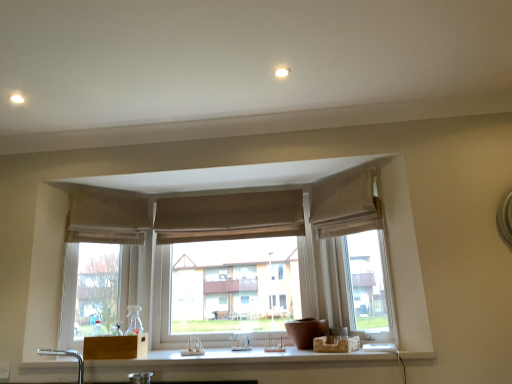
Identify the location of beige fabric curtain at upper right, which ranks as the 1th curtain in right-to-left order. The image size is (512, 384). (346, 206).

Identify the location of beige fabric curtain at upper center, the 3th curtain in the right-to-left sequence. Image resolution: width=512 pixels, height=384 pixels. (106, 219).

Looking at this image, considering the sizes of objects brown fabric curtain at center, marked as the 2th curtain in a right-to-left arrangement, and beige fabric curtain at upper right, which ranks as the 1th curtain in right-to-left order, in the image provided, who is taller, brown fabric curtain at center, marked as the 2th curtain in a right-to-left arrangement, or beige fabric curtain at upper right, which ranks as the 1th curtain in right-to-left order,?

beige fabric curtain at upper right, which ranks as the 1th curtain in right-to-left order.

From a real-world perspective, who is located higher, brown fabric curtain at center, marked as the 2th curtain in a right-to-left arrangement, or beige fabric curtain at upper right, which ranks as the 1th curtain in right-to-left order?

In real-world perspective, brown fabric curtain at center, marked as the 2th curtain in a right-to-left arrangement, is above.

Which is farther, (264,193) or (358,183)?

The point (264,193) is farther.

Is brown fabric curtain at center, placed as the 2th curtain when sorted from left to right, touching beige fabric curtain at upper right, which ranks as the 1th curtain in right-to-left order?

No, brown fabric curtain at center, placed as the 2th curtain when sorted from left to right, is not touching beige fabric curtain at upper right, which ranks as the 1th curtain in right-to-left order.

Considering the sizes of objects beige fabric curtain at upper right, the 3th curtain when ordered from left to right, and beige fabric curtain at upper center, the first curtain in the left-to-right sequence, in the image provided, who is shorter, beige fabric curtain at upper right, the 3th curtain when ordered from left to right, or beige fabric curtain at upper center, the first curtain in the left-to-right sequence,?

beige fabric curtain at upper center, the first curtain in the left-to-right sequence, is shorter.

Can you confirm if beige fabric curtain at upper right, which ranks as the 1th curtain in right-to-left order, is positioned to the left of beige fabric curtain at upper center, the first curtain in the left-to-right sequence?

Incorrect, beige fabric curtain at upper right, which ranks as the 1th curtain in right-to-left order, is not on the left side of beige fabric curtain at upper center, the first curtain in the left-to-right sequence.

Considering the positions of objects beige fabric curtain at upper right, which ranks as the 1th curtain in right-to-left order, and beige fabric curtain at upper center, the 3th curtain in the right-to-left sequence, in the image provided, who is behind, beige fabric curtain at upper right, which ranks as the 1th curtain in right-to-left order, or beige fabric curtain at upper center, the 3th curtain in the right-to-left sequence,?

beige fabric curtain at upper center, the 3th curtain in the right-to-left sequence, is further away from the camera.

Would you say beige fabric curtain at upper right, the 3th curtain when ordered from left to right, is inside or outside beige fabric curtain at upper center, the 3th curtain in the right-to-left sequence?

beige fabric curtain at upper right, the 3th curtain when ordered from left to right, is spatially situated outside beige fabric curtain at upper center, the 3th curtain in the right-to-left sequence.

Does beige fabric curtain at upper center, the 3th curtain in the right-to-left sequence, have a greater height compared to brown fabric curtain at center, marked as the 2th curtain in a right-to-left arrangement?

Correct, beige fabric curtain at upper center, the 3th curtain in the right-to-left sequence, is much taller as brown fabric curtain at center, marked as the 2th curtain in a right-to-left arrangement.

Is the surface of beige fabric curtain at upper center, the first curtain in the left-to-right sequence, in direct contact with brown fabric curtain at center, placed as the 2th curtain when sorted from left to right?

No, beige fabric curtain at upper center, the first curtain in the left-to-right sequence, is not beside brown fabric curtain at center, placed as the 2th curtain when sorted from left to right.

Is beige fabric curtain at upper center, the 3th curtain in the right-to-left sequence, positioned with its back to brown fabric curtain at center, placed as the 2th curtain when sorted from left to right?

No, beige fabric curtain at upper center, the 3th curtain in the right-to-left sequence, is not facing the opposite direction of brown fabric curtain at center, placed as the 2th curtain when sorted from left to right.

Is point (89, 195) closer or farther from the camera than point (247, 193)?

Point (89, 195) appears to be closer to the viewer than point (247, 193).

Is beige fabric curtain at upper center, the 3th curtain in the right-to-left sequence, not near beige fabric curtain at upper right, the 3th curtain when ordered from left to right?

Yes, beige fabric curtain at upper center, the 3th curtain in the right-to-left sequence, and beige fabric curtain at upper right, the 3th curtain when ordered from left to right, are quite far apart.

Based on the photo, from the image's perspective, does beige fabric curtain at upper center, the first curtain in the left-to-right sequence, appear lower than beige fabric curtain at upper right, which ranks as the 1th curtain in right-to-left order?

Indeed, from the image's perspective, beige fabric curtain at upper center, the first curtain in the left-to-right sequence, is shown beneath beige fabric curtain at upper right, which ranks as the 1th curtain in right-to-left order.

Which is behind, point (99, 235) or point (356, 179)?

Point (99, 235)

From a real-world perspective, is beige fabric curtain at upper center, the first curtain in the left-to-right sequence, on beige fabric curtain at upper right, the 3th curtain when ordered from left to right?

Indeed, from a real-world perspective, beige fabric curtain at upper center, the first curtain in the left-to-right sequence, stands above beige fabric curtain at upper right, the 3th curtain when ordered from left to right.

Can you confirm if beige fabric curtain at upper right, which ranks as the 1th curtain in right-to-left order, is taller than brown fabric curtain at center, placed as the 2th curtain when sorted from left to right?

Correct, beige fabric curtain at upper right, which ranks as the 1th curtain in right-to-left order, is much taller as brown fabric curtain at center, placed as the 2th curtain when sorted from left to right.

Is beige fabric curtain at upper right, the 3th curtain when ordered from left to right, directly adjacent to brown fabric curtain at center, marked as the 2th curtain in a right-to-left arrangement?

No, beige fabric curtain at upper right, the 3th curtain when ordered from left to right, is not next to brown fabric curtain at center, marked as the 2th curtain in a right-to-left arrangement.

Is beige fabric curtain at upper right, which ranks as the 1th curtain in right-to-left order, oriented towards brown fabric curtain at center, marked as the 2th curtain in a right-to-left arrangement?

No, beige fabric curtain at upper right, which ranks as the 1th curtain in right-to-left order, is not aimed at brown fabric curtain at center, marked as the 2th curtain in a right-to-left arrangement.

From a real-world perspective, is beige fabric curtain at upper right, which ranks as the 1th curtain in right-to-left order, over brown fabric curtain at center, marked as the 2th curtain in a right-to-left arrangement?

Actually, beige fabric curtain at upper right, which ranks as the 1th curtain in right-to-left order, is physically below brown fabric curtain at center, marked as the 2th curtain in a right-to-left arrangement, in the real world.

From a real-world perspective, between brown fabric curtain at center, placed as the 2th curtain when sorted from left to right, and beige fabric curtain at upper center, the first curtain in the left-to-right sequence, who is vertically higher?

brown fabric curtain at center, placed as the 2th curtain when sorted from left to right, from a real-world perspective.

Does brown fabric curtain at center, marked as the 2th curtain in a right-to-left arrangement, have a smaller size compared to beige fabric curtain at upper center, the 3th curtain in the right-to-left sequence?

Yes.

How different are the orientations of brown fabric curtain at center, marked as the 2th curtain in a right-to-left arrangement, and beige fabric curtain at upper center, the 3th curtain in the right-to-left sequence, in degrees?

They differ by 42.6 degrees in their facing directions.

Which is correct: brown fabric curtain at center, placed as the 2th curtain when sorted from left to right, is inside beige fabric curtain at upper center, the 3th curtain in the right-to-left sequence, or outside of it?

brown fabric curtain at center, placed as the 2th curtain when sorted from left to right, exists outside the volume of beige fabric curtain at upper center, the 3th curtain in the right-to-left sequence.

Where is `curtain above the brown fabric curtain at center, placed as the 2th curtain when sorted from left to right (from the image's perspective)`? curtain above the brown fabric curtain at center, placed as the 2th curtain when sorted from left to right (from the image's perspective) is located at coordinates (346, 206).

I want to click on curtain below the beige fabric curtain at upper center, the 3th curtain in the right-to-left sequence (from a real-world perspective), so click(x=346, y=206).

From the image, which object appears to be farther from beige fabric curtain at upper right, which ranks as the 1th curtain in right-to-left order, brown fabric curtain at center, marked as the 2th curtain in a right-to-left arrangement, or beige fabric curtain at upper center, the first curtain in the left-to-right sequence?

beige fabric curtain at upper center, the first curtain in the left-to-right sequence, is further to beige fabric curtain at upper right, which ranks as the 1th curtain in right-to-left order.

From the image, which object appears to be nearer to brown fabric curtain at center, marked as the 2th curtain in a right-to-left arrangement, beige fabric curtain at upper center, the 3th curtain in the right-to-left sequence, or beige fabric curtain at upper right, which ranks as the 1th curtain in right-to-left order?

Among the two, beige fabric curtain at upper center, the 3th curtain in the right-to-left sequence, is located nearer to brown fabric curtain at center, marked as the 2th curtain in a right-to-left arrangement.

Based on the photo, which object lies further to the anchor point brown fabric curtain at center, marked as the 2th curtain in a right-to-left arrangement, beige fabric curtain at upper right, which ranks as the 1th curtain in right-to-left order, or beige fabric curtain at upper center, the 3th curtain in the right-to-left sequence?

beige fabric curtain at upper right, which ranks as the 1th curtain in right-to-left order, is further to brown fabric curtain at center, marked as the 2th curtain in a right-to-left arrangement.

Based on their spatial positions, is brown fabric curtain at center, placed as the 2th curtain when sorted from left to right, or beige fabric curtain at upper right, which ranks as the 1th curtain in right-to-left order, closer to beige fabric curtain at upper center, the first curtain in the left-to-right sequence?

brown fabric curtain at center, placed as the 2th curtain when sorted from left to right, is closer to beige fabric curtain at upper center, the first curtain in the left-to-right sequence.

Considering their positions, is beige fabric curtain at upper right, which ranks as the 1th curtain in right-to-left order, positioned further to beige fabric curtain at upper center, the first curtain in the left-to-right sequence, than brown fabric curtain at center, placed as the 2th curtain when sorted from left to right?

beige fabric curtain at upper right, which ranks as the 1th curtain in right-to-left order.

When comparing their distances from beige fabric curtain at upper right, which ranks as the 1th curtain in right-to-left order, does beige fabric curtain at upper center, the 3th curtain in the right-to-left sequence, or brown fabric curtain at center, placed as the 2th curtain when sorted from left to right, seem closer?

brown fabric curtain at center, placed as the 2th curtain when sorted from left to right, lies closer to beige fabric curtain at upper right, which ranks as the 1th curtain in right-to-left order, than the other object.

I want to click on curtain between beige fabric curtain at upper center, the first curtain in the left-to-right sequence, and beige fabric curtain at upper right, which ranks as the 1th curtain in right-to-left order, so click(229, 217).